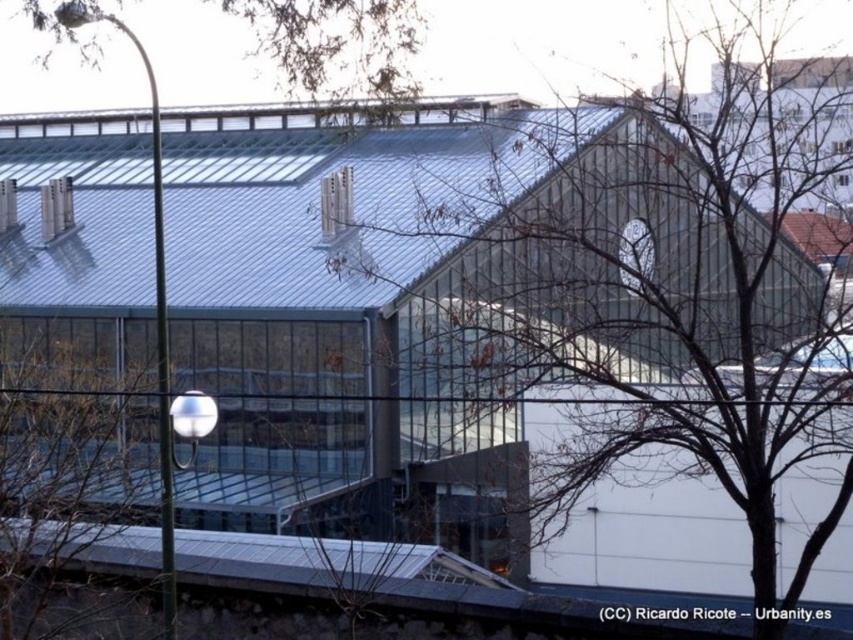
You are a photographer trying to capture the modern building in the image. You notice two trees in the scene. Which tree has a narrower width, the bare branches at center or the brown leafy tree at upper center?

The bare branches at center has a narrower width than the brown leafy tree at upper center.

You are standing at the point with coordinates point (619, 243) and want to walk towards the point with coordinates point (1, 342). Will you have an unobstructed path to reach the second point?

Point (1, 342) is behind point (619, 243), so you cannot reach it without moving around the obstacle.

You are standing at the center of the image. Which direction should you move to get closer to the green leafy tree at left?

You should move to the left to get closer to the green leafy tree at left since it is located at the left side of the image.